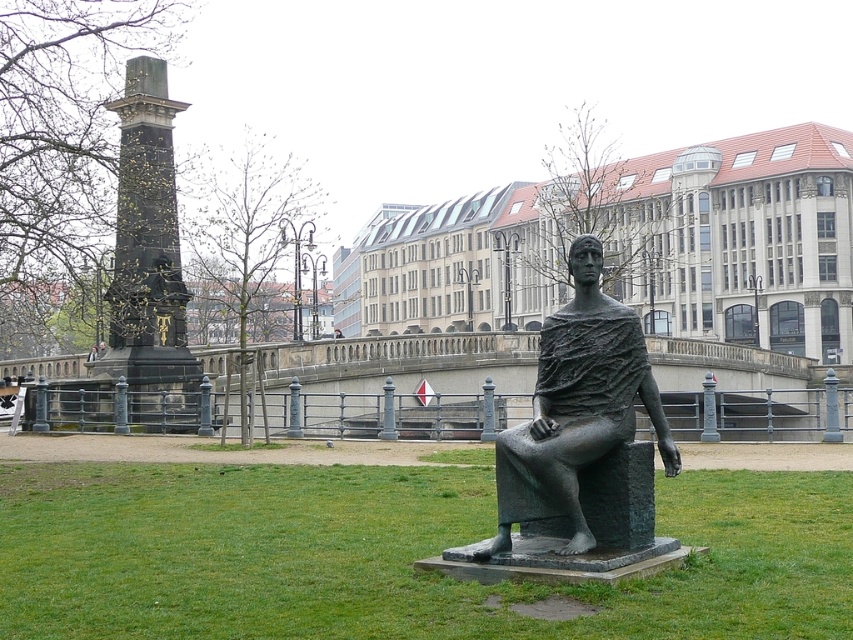
Question: Which point is closer to the camera?

Choices:
 (A) green grass at lower center
 (B) bronze/statue at center
 (C) dark brown stone column at left

Answer: (A)

Question: Can you confirm if green grass at lower center is smaller than bronze/statue at center?

Choices:
 (A) yes
 (B) no

Answer: (B)

Question: Which point is closer to the camera?

Choices:
 (A) (218, 579)
 (B) (155, 273)

Answer: (A)

Question: Estimate the real-world distances between objects in this image. Which object is closer to the bronze/statue at center?

Choices:
 (A) green grass at lower center
 (B) dark brown stone column at left

Answer: (A)

Question: Is the position of green grass at lower center more distant than that of bronze/statue at center?

Choices:
 (A) no
 (B) yes

Answer: (A)

Question: Can you confirm if green grass at lower center is thinner than dark brown stone column at left?

Choices:
 (A) no
 (B) yes

Answer: (A)